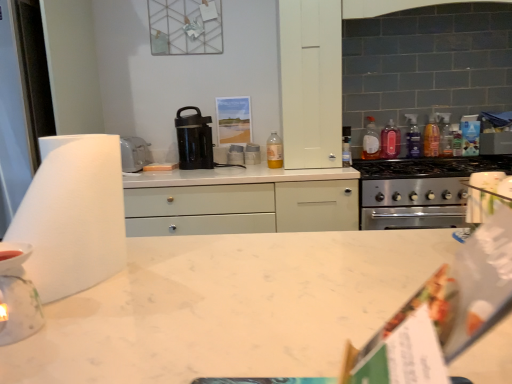
Question: Can you confirm if white matte paper towel at left is shorter than translucent plastic bottle at stove top, the 4th bottle in the left-to-right sequence?

Choices:
 (A) yes
 (B) no

Answer: (B)

Question: Is white matte paper towel at left positioned behind translucent plastic bottle at stove top, the 4th bottle in the left-to-right sequence?

Choices:
 (A) yes
 (B) no

Answer: (B)

Question: Is white matte paper towel at left not within translucent plastic bottle at stove top, positioned as the second bottle in right-to-left order?

Choices:
 (A) no
 (B) yes

Answer: (B)

Question: From the image's perspective, is white matte paper towel at left beneath translucent plastic bottle at stove top, the 4th bottle in the left-to-right sequence?

Choices:
 (A) yes
 (B) no

Answer: (A)

Question: Is white matte paper towel at left not near translucent plastic bottle at stove top, the 4th bottle in the left-to-right sequence?

Choices:
 (A) no
 (B) yes

Answer: (B)

Question: Can you confirm if white matte paper towel at left is taller than translucent plastic bottle at stove top, positioned as the second bottle in right-to-left order?

Choices:
 (A) yes
 (B) no

Answer: (A)

Question: From the image's perspective, is translucent plastic bottle at stove top, positioned as the second bottle in right-to-left order, beneath translucent plastic bottle at upper center, positioned as the fifth bottle in right-to-left order?

Choices:
 (A) yes
 (B) no

Answer: (B)

Question: Is translucent plastic bottle at stove top, positioned as the second bottle in right-to-left order, outside of translucent plastic bottle at upper center, which is the 1th bottle from left to right?

Choices:
 (A) no
 (B) yes

Answer: (B)

Question: From a real-world perspective, is translucent plastic bottle at stove top, positioned as the second bottle in right-to-left order, physically above translucent plastic bottle at upper center, positioned as the fifth bottle in right-to-left order?

Choices:
 (A) yes
 (B) no

Answer: (A)

Question: From a real-world perspective, does translucent plastic bottle at stove top, positioned as the second bottle in right-to-left order, sit lower than translucent plastic bottle at upper center, positioned as the fifth bottle in right-to-left order?

Choices:
 (A) no
 (B) yes

Answer: (A)

Question: Could you tell me if translucent plastic bottle at stove top, the 4th bottle in the left-to-right sequence, is facing translucent plastic bottle at upper center, positioned as the fifth bottle in right-to-left order?

Choices:
 (A) yes
 (B) no

Answer: (B)

Question: Is translucent plastic bottle at stove top, the 4th bottle in the left-to-right sequence, at the right side of translucent plastic bottle at upper center, which is the 1th bottle from left to right?

Choices:
 (A) no
 (B) yes

Answer: (B)

Question: Is the depth of white glossy stack of plates at center, which appears as the 3th appliance when viewed from the left, greater than that of translucent plastic bottle at upper right, the third bottle positioned from the left?

Choices:
 (A) yes
 (B) no

Answer: (A)